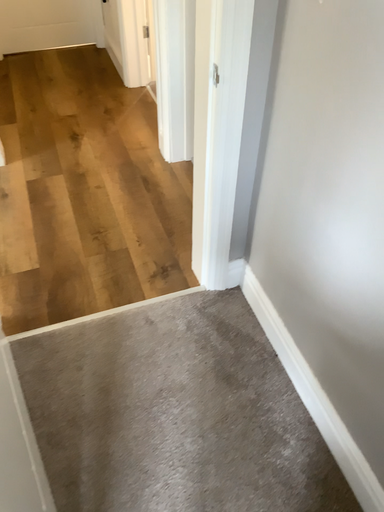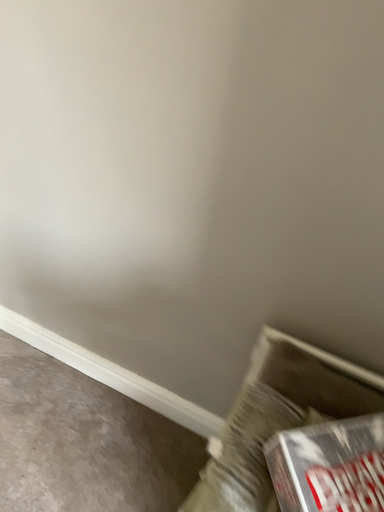
Question: How did the camera likely rotate when shooting the video?

Choices:
 (A) rotated upward
 (B) rotated downward

Answer: (A)